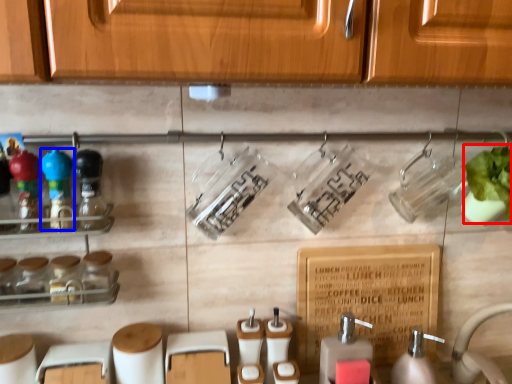
Question: Among these objects, which one is nearest to the camera, plant (highlighted by a red box) or bottle (highlighted by a blue box)?

Choices:
 (A) plant
 (B) bottle

Answer: (B)